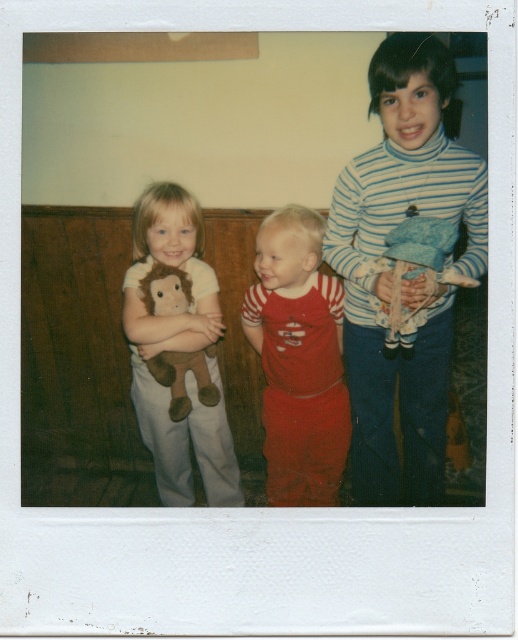
Question: Which of the following is the closest to the observer?

Choices:
 (A) (212, 502)
 (B) (326, 428)
 (C) (451, 161)
 (D) (143, 278)

Answer: (C)

Question: Which object appears closest to the camera in this image?

Choices:
 (A) blue striped sweater at upper right
 (B) brown plush toy at left
 (C) soft brown plush monkey at left
 (D) red cotton overalls at center

Answer: (A)

Question: Which of the following is the closest to the observer?

Choices:
 (A) blue striped sweater at upper right
 (B) brown plush toy at left
 (C) soft brown plush monkey at left
 (D) blue fabric doll at right

Answer: (A)

Question: Is blue striped sweater at upper right positioned in front of soft brown plush monkey at left?

Choices:
 (A) yes
 (B) no

Answer: (A)

Question: Is blue striped sweater at upper right wider than blue fabric doll at right?

Choices:
 (A) no
 (B) yes

Answer: (B)

Question: Is blue striped sweater at upper right wider than red cotton overalls at center?

Choices:
 (A) yes
 (B) no

Answer: (A)